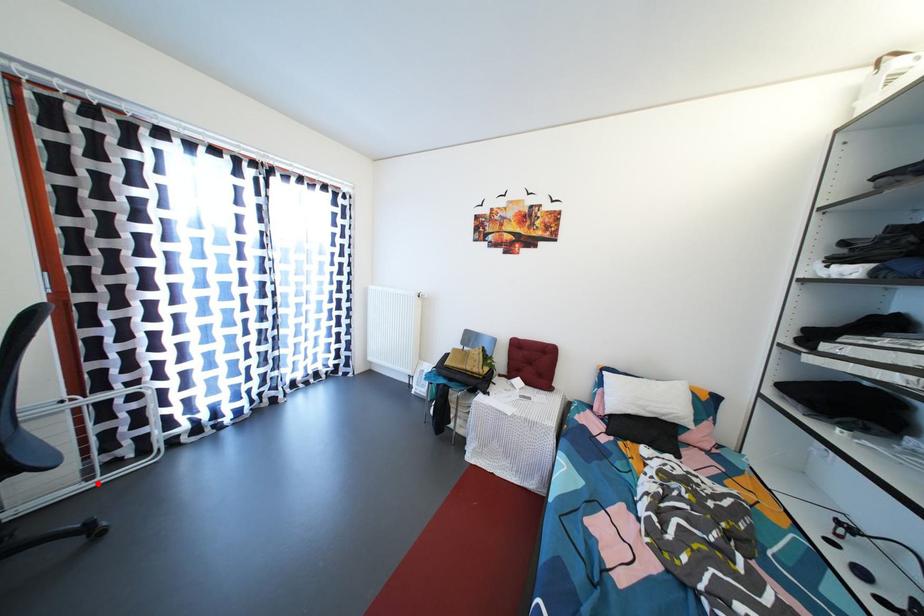
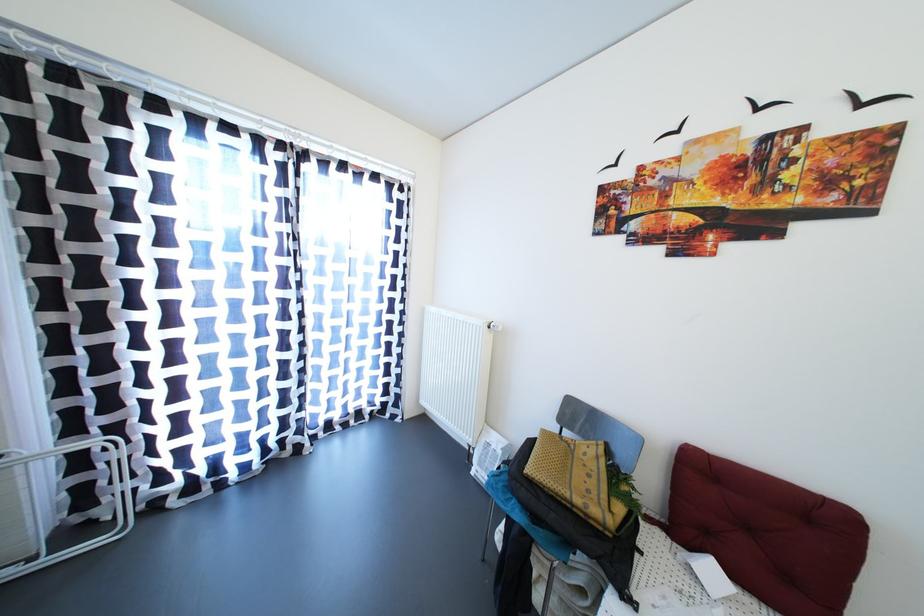
Question: A red point is marked in image1. In image2, is the corresponding 3D point closer to the camera or farther? Reply with the corresponding letter.

Choices:
 (A) The corresponding 3D point is closer.
 (B) The corresponding 3D point is farther.

Answer: (A)